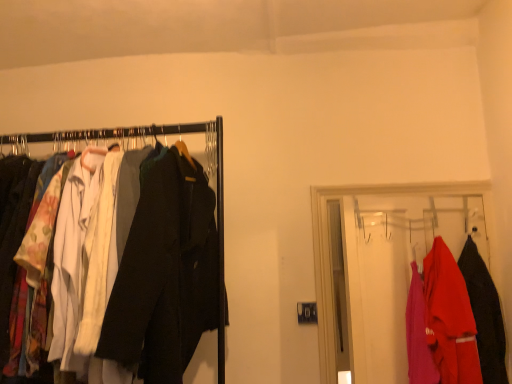
Question: From a real-world perspective, is matte black coat at right, marked as the 2th fancy dress in a left-to-right arrangement, physically located above or below matte black coat rack at left, positioned as the 2th closet in right-to-left order?

Choices:
 (A) below
 (B) above

Answer: (A)

Question: Is point (480, 365) closer or farther from the camera than point (209, 122)?

Choices:
 (A) farther
 (B) closer

Answer: (A)

Question: Considering the real-world distances, which object is farthest from the matte plastic hanger at right, arranged as the second closet when viewed from the left?

Choices:
 (A) matte red shirt at right, the 1th fancy dress from the left
 (B) matte black coat rack at left, positioned as the 2th closet in right-to-left order
 (C) matte black coat at right, the 1th fancy dress viewed from the right

Answer: (B)

Question: Which object is the farthest from the matte black coat rack at left, positioned as the 1th closet in left-to-right order?

Choices:
 (A) matte plastic hanger at right, arranged as the second closet when viewed from the left
 (B) matte red shirt at right, the 1th fancy dress from the left
 (C) matte black coat at right, marked as the 2th fancy dress in a left-to-right arrangement

Answer: (C)